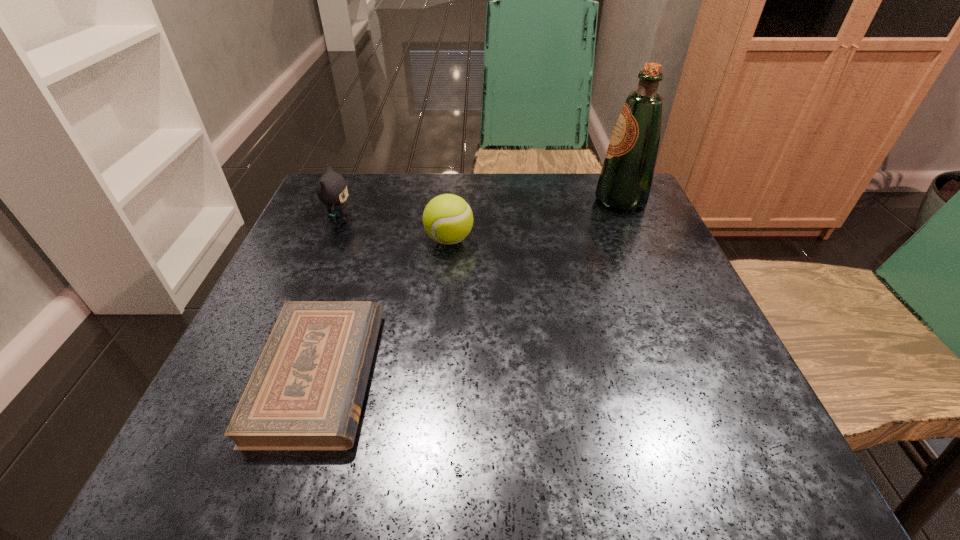
Identify which object is the closest to the rightmost object. Please provide its 2D coordinates. Your answer should be formatted as a tuple, i.e. [(x, y)], where the tuple contains the x and y coordinates of a point satisfying the conditions above.

[(447, 219)]

Where is `vacant area in the image that satisfies the following two spatial constraints: 1. on the front side of the second object from right to left; 2. on the spine side of the nearest object`? vacant area in the image that satisfies the following two spatial constraints: 1. on the front side of the second object from right to left; 2. on the spine side of the nearest object is located at coordinates (438, 375).